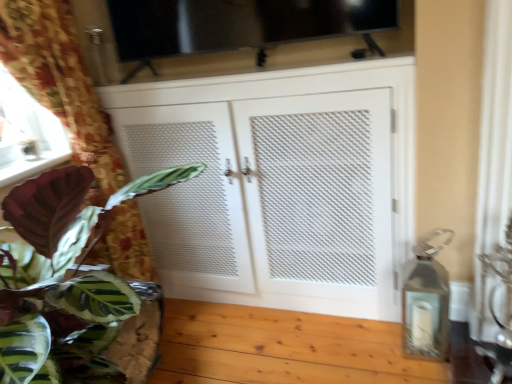
Question: Based on their sizes in the image, would you say white textured cabinet at center is bigger or smaller than matte brown wood at lower left?

Choices:
 (A) big
 (B) small

Answer: (A)

Question: Considering the positions of white textured cabinet at center and matte brown wood at lower left in the image, is white textured cabinet at center taller or shorter than matte brown wood at lower left?

Choices:
 (A) tall
 (B) short

Answer: (A)

Question: Which object is the farthest from the transparent glass window screen at upper center?

Choices:
 (A) white sheer curtain at right, which ranks as the second curtain in left-to-right order
 (B) matte brown wood at lower left
 (C) white textured cabinet at center
 (D) floral fabric curtain at left, marked as the 2th curtain in a right-to-left arrangement
 (E) green leafy plant at left

Answer: (E)

Question: Considering the real-world distances, which object is farthest from the transparent glass window screen at upper center?

Choices:
 (A) matte brown wood at lower left
 (B) white sheer curtain at right, which ranks as the second curtain in left-to-right order
 (C) green leafy plant at left
 (D) floral fabric curtain at left, arranged as the 1th curtain when viewed from the left
 (E) white textured cabinet at center

Answer: (C)